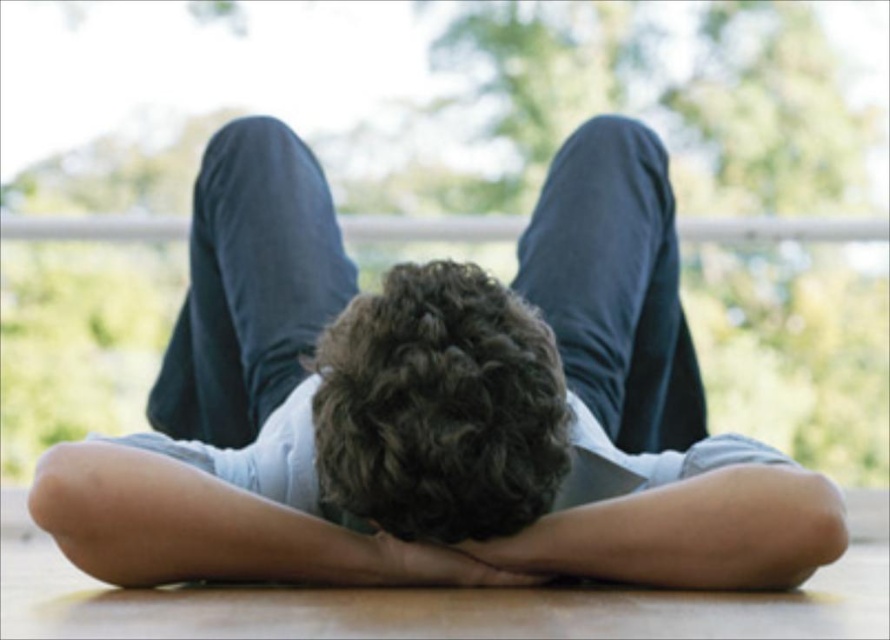
Question: In this image, where is light blue denim shorts at center located relative to smooth skin hand at center?

Choices:
 (A) above
 (B) below

Answer: (A)

Question: Is light blue denim shorts at center to the left of dark curly hair at center from the viewer's perspective?

Choices:
 (A) yes
 (B) no

Answer: (A)

Question: Which object is farther from the camera taking this photo?

Choices:
 (A) light blue denim shorts at center
 (B) smooth skin hand at center
 (C) dark curly hair at center

Answer: (B)

Question: Which point is farther to the camera?

Choices:
 (A) (820, 531)
 (B) (439, 536)
 (C) (399, 554)

Answer: (C)

Question: Which of the following is the closest to the observer?

Choices:
 (A) (333, 262)
 (B) (492, 579)
 (C) (374, 422)

Answer: (C)

Question: Does light blue denim shorts at center appear on the right side of smooth skin hand at center?

Choices:
 (A) yes
 (B) no

Answer: (B)